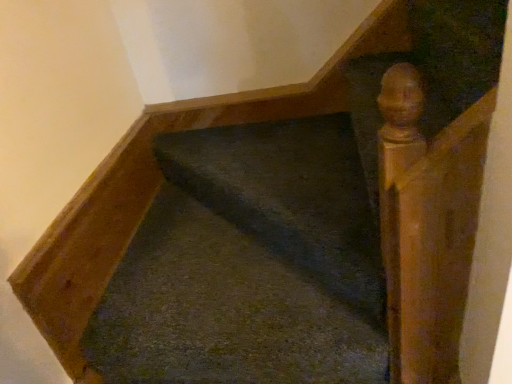
What are the coordinates of `wooden post at upper right` in the screenshot? It's located at (426, 225).

This screenshot has height=384, width=512. Describe the element at coordinates (426, 225) in the screenshot. I see `wooden post at upper right` at that location.

At what (x,y) coordinates should I click in order to perform the action: click on wooden post at upper right. Please return your answer as a coordinate pair (x, y). Looking at the image, I should click on (426, 225).